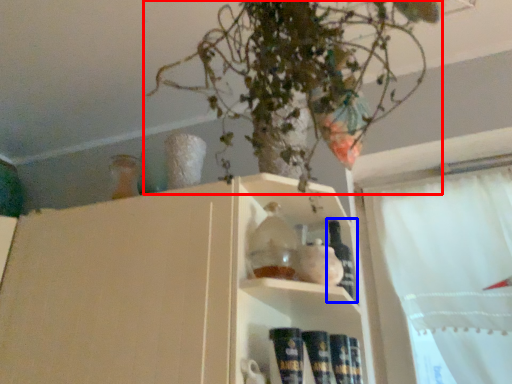
Question: Which object appears farthest to the camera in this image, houseplant (highlighted by a red box) or bottle (highlighted by a blue box)?

Choices:
 (A) houseplant
 (B) bottle

Answer: (B)